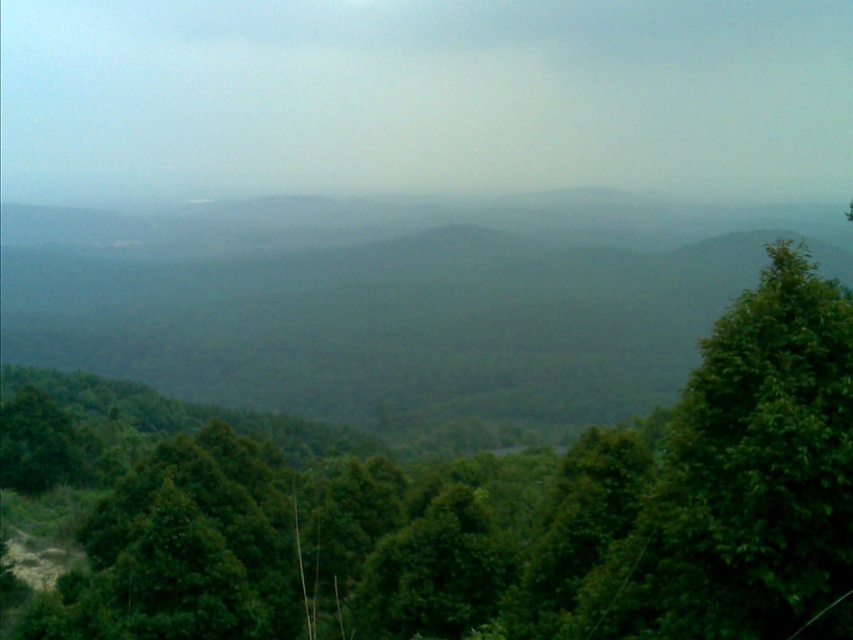
Between green leafy tree at center and green leafy forest at center, which one appears on the left side from the viewer's perspective?

green leafy forest at center is more to the left.

You are a GUI agent. You are given a task and a screenshot of the screen. Output one action in this format:
    pyautogui.click(x=<x>, y=<y>)
    Task: Click on the green leafy tree at center
    The width and height of the screenshot is (853, 640).
    Given the screenshot: What is the action you would take?
    pos(485,513)

Does point (137, 467) lie behind point (178, 252)?

No, it is not.

This screenshot has width=853, height=640. What are the coordinates of `green leafy tree at center` in the screenshot? It's located at (485, 513).